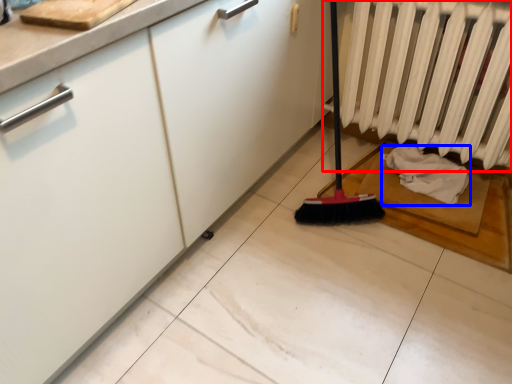
Question: Which object is further to the camera taking this photo, radiator (highlighted by a red box) or material (highlighted by a blue box)?

Choices:
 (A) radiator
 (B) material

Answer: (B)